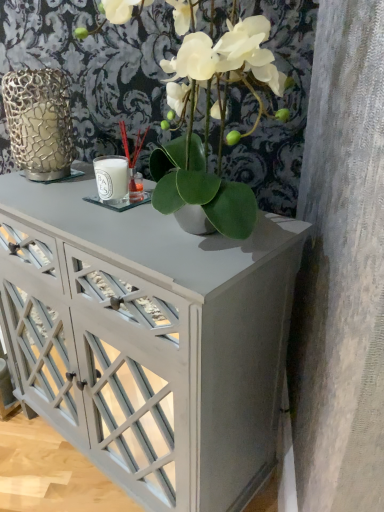
Question: From a real-world perspective, is green matte plant at center above or below gold textured vase at left?

Choices:
 (A) above
 (B) below

Answer: (A)

Question: From the image's perspective, is green matte plant at center above or below gold textured vase at left?

Choices:
 (A) above
 (B) below

Answer: (B)

Question: Which object is positioned closest to the gold textured vase at left?

Choices:
 (A) white glossy cabinet at center
 (B) green matte plant at center

Answer: (B)

Question: Which of these objects is positioned closest to the white glossy cabinet at center?

Choices:
 (A) green matte plant at center
 (B) gold textured vase at left

Answer: (A)